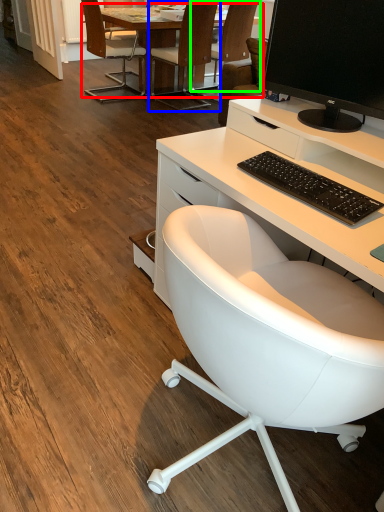
Question: Which is farther away from table (highlighted by a red box)? chair (highlighted by a blue box) or chair (highlighted by a green box)?

Choices:
 (A) chair
 (B) chair

Answer: (B)